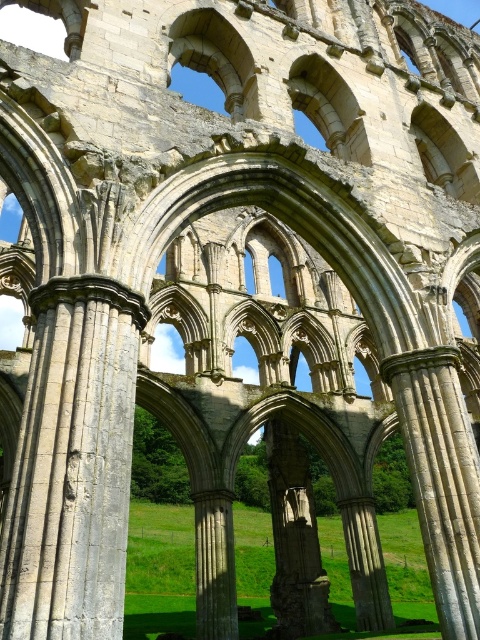
You are standing in front of the ruins of an old church and want to take a photo. You notice two points marked on your map at coordinates point [79,316] and point [396,355]. Which point is closer to you?

Point [79,316] is closer to the camera than point [396,355], so the point closer to you is point [79,316].